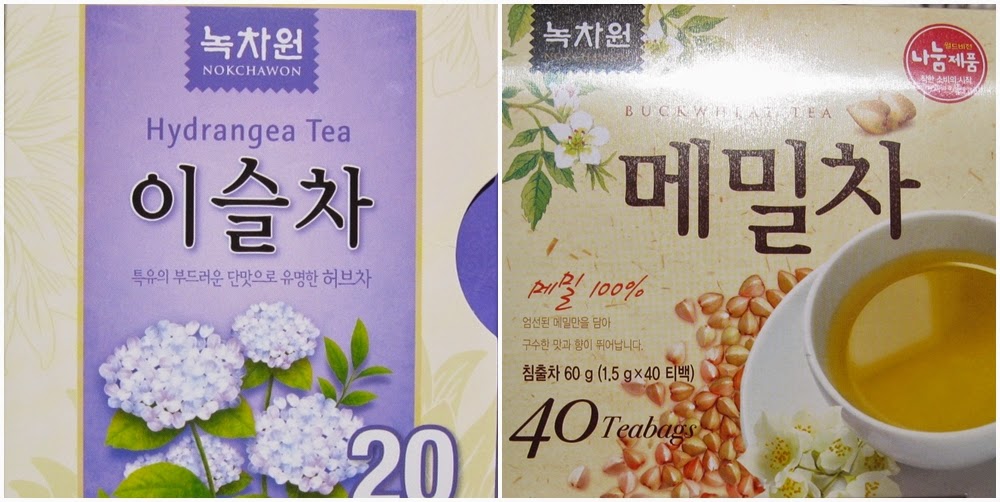
Locate an element on the screen. coffee cup is located at coordinates (874, 435).